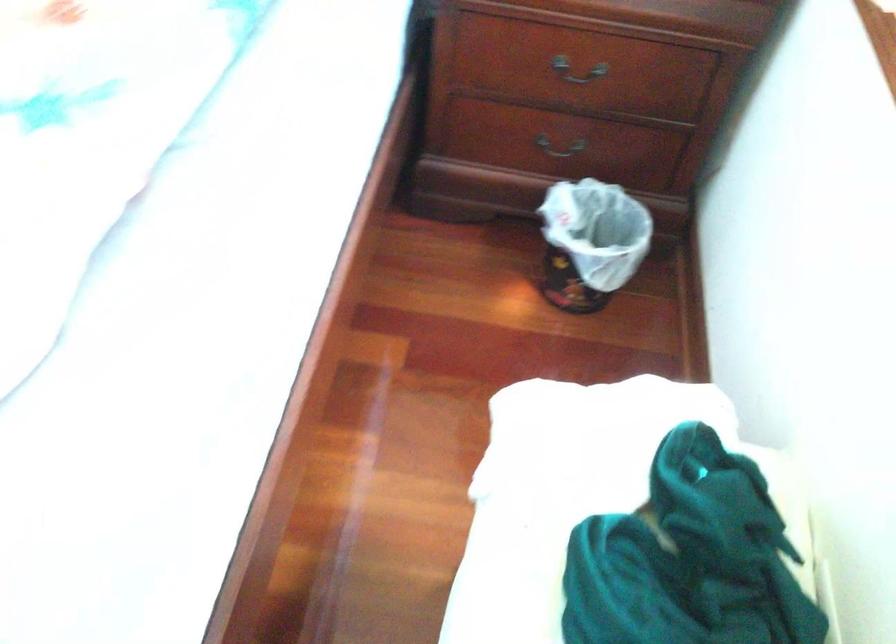
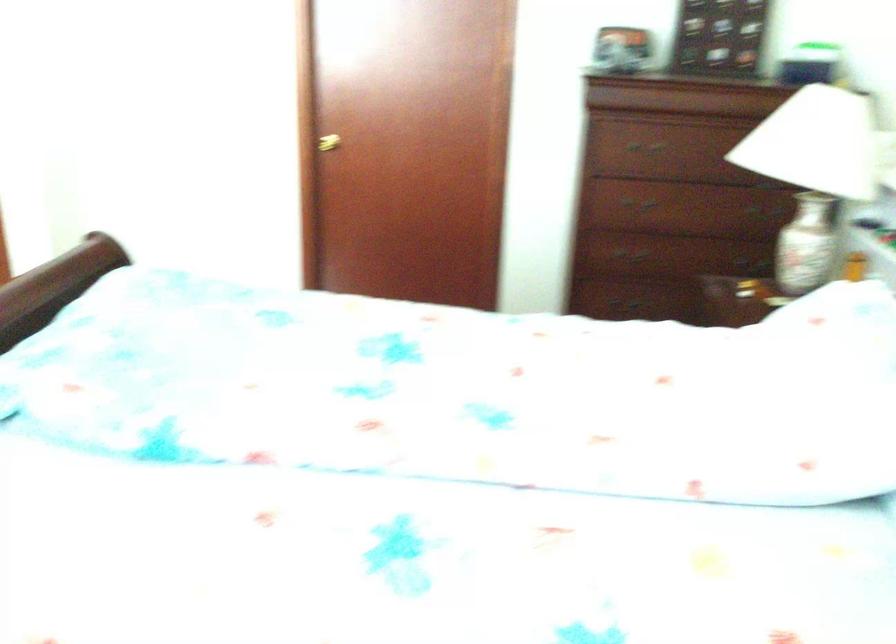
Question: The camera is either moving clockwise (left) or counter-clockwise (right) around the object. The first image is from the beginning of the video and the second image is from the end. Is the camera moving left or right when shooting the video?

Choices:
 (A) Left
 (B) Right

Answer: (B)